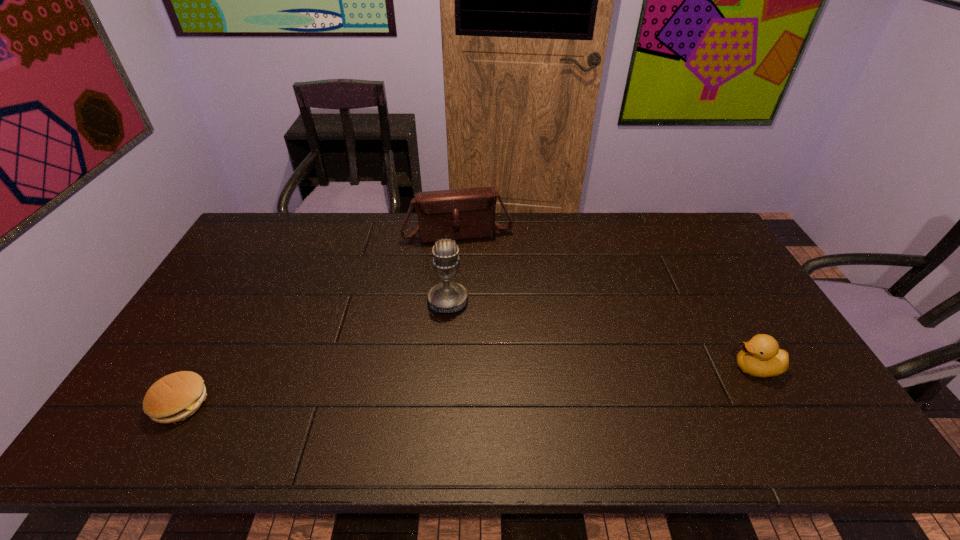
At what (x,y) coordinates should I click in order to perform the action: click on vacant space on the desktop that is between the patty and the third tallest object and is positioned on the front flap of the third shortest object. Please return your answer as a coordinate pair (x, y). The width and height of the screenshot is (960, 540). Looking at the image, I should click on (493, 384).

Locate an element on the screen. free space on the desktop that is between the shortest object and the third tallest object and is positioned on the front-facing side of the microphone is located at coordinates 446,387.